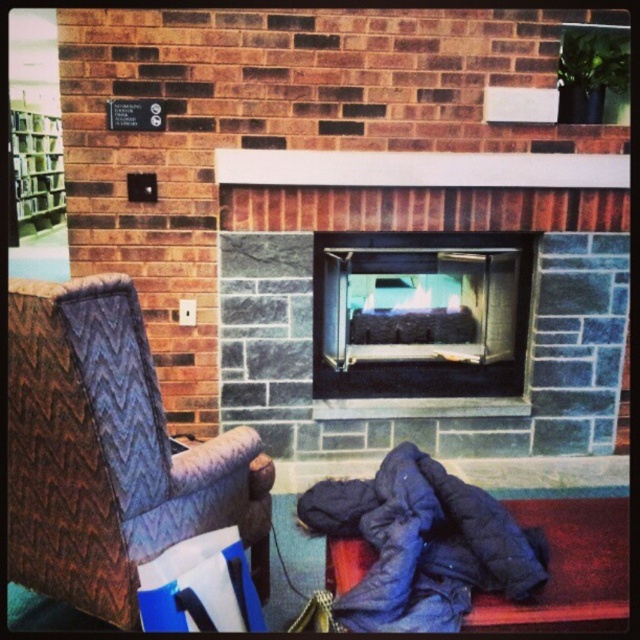
Question: Does gray stone fireplace at center have a smaller size compared to dark blue quilted sleeping bag at lower right?

Choices:
 (A) no
 (B) yes

Answer: (A)

Question: Is gray stone fireplace at center bigger than brown quilted fabric armchair at left?

Choices:
 (A) yes
 (B) no

Answer: (A)

Question: Is matte glass fireplace at center wider than dark blue quilted sleeping bag at lower right?

Choices:
 (A) no
 (B) yes

Answer: (B)

Question: Based on their relative distances, which object is farther from the brown quilted fabric armchair at left?

Choices:
 (A) gray stone fireplace at center
 (B) matte glass fireplace at center

Answer: (B)

Question: Among these objects, which one is nearest to the camera?

Choices:
 (A) dark blue quilted sleeping bag at lower right
 (B) brown quilted fabric armchair at left

Answer: (A)

Question: Among these points, which one is nearest to the camera?

Choices:
 (A) (451, 269)
 (B) (51, 129)
 (C) (442, 512)
 (D) (317, 451)

Answer: (C)